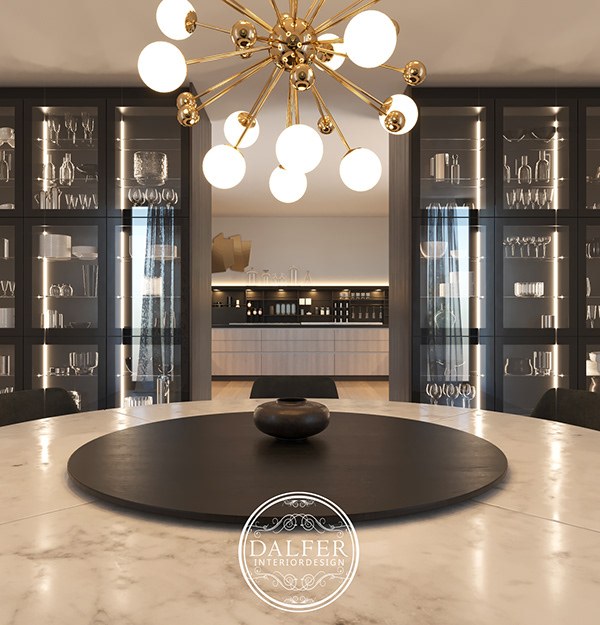
Image resolution: width=600 pixels, height=625 pixels. In order to click on floor in this screenshot , I will do `click(503, 546)`.